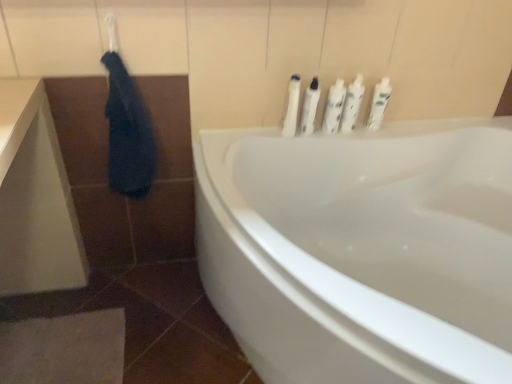
The width and height of the screenshot is (512, 384). I want to click on vacant space to the left of white plastic bottles at upper right, the 1th toiletry viewed from the left, so click(x=249, y=140).